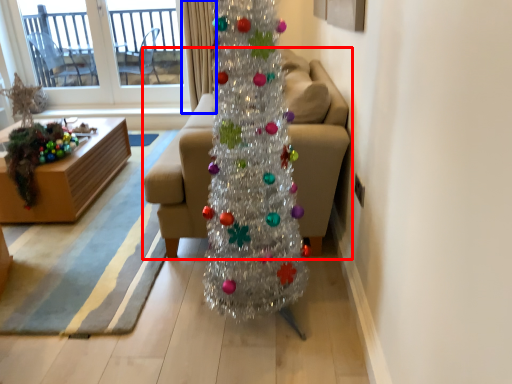
Question: Among these objects, which one is nearest to the camera, studio couch (highlighted by a red box) or curtain (highlighted by a blue box)?

Choices:
 (A) studio couch
 (B) curtain

Answer: (A)